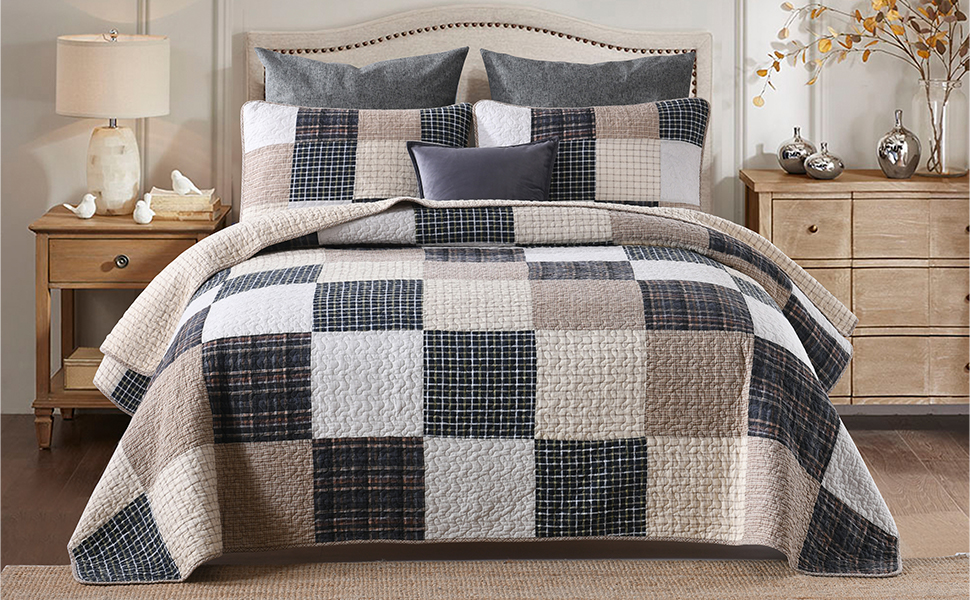
Find the location of `drawer`. drawer is located at coordinates (77, 265), (820, 225), (919, 370), (913, 299), (914, 230), (839, 281), (838, 386).